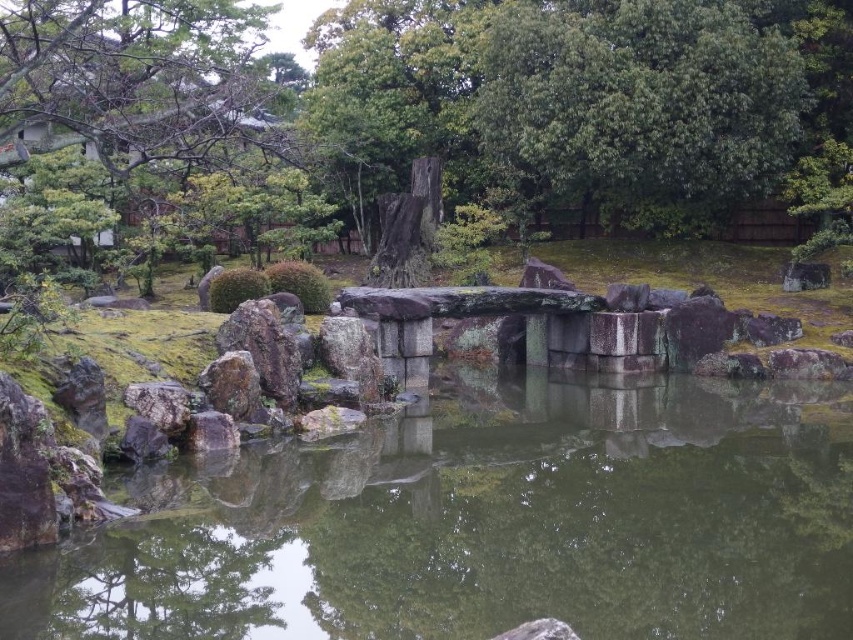
This screenshot has width=853, height=640. Describe the element at coordinates (485, 524) in the screenshot. I see `green mossy water at center` at that location.

Does green mossy water at center have a larger size compared to smooth gray rock at lower center?

Yes, green mossy water at center is bigger than smooth gray rock at lower center.

Which is behind, point (498, 376) or point (219, 419)?

Point (498, 376)

What are the coordinates of `green mossy water at center` in the screenshot? It's located at (485, 524).

Based on the photo, between smooth bark tree trunk at center and smooth gray rock at lower center, which one is positioned higher?

smooth bark tree trunk at center is above.

Is point (695, 93) more distant than point (233, 445)?

Yes, it is.

You are a GUI agent. You are given a task and a screenshot of the screen. Output one action in this format:
    pyautogui.click(x=<x>, y=<y>)
    Task: Click on the smooth bark tree trunk at center
    This screenshot has height=640, width=853.
    Given the screenshot: What is the action you would take?
    pyautogui.click(x=583, y=100)

Who is more forward, (154, 604) or (33, 4)?

Point (154, 604) is in front.

Which is behind, point (630, 461) or point (122, 134)?

The point (122, 134) is more distant.

Between point (546, 486) and point (103, 138), which one is positioned in front?

Point (546, 486) is more forward.

The width and height of the screenshot is (853, 640). In order to click on green mossy water at center in this screenshot , I will do `click(485, 524)`.